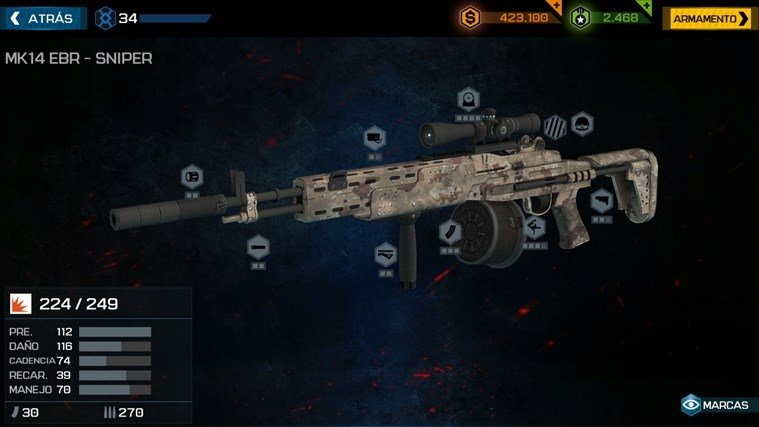
The width and height of the screenshot is (759, 427). What are the coordinates of `bolt lock` in the screenshot? It's located at (517, 161).